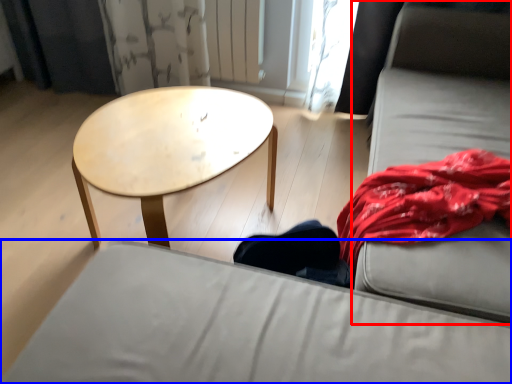
Question: Which of the following is the closest to the observer, couch (highlighted by a red box) or studio couch (highlighted by a blue box)?

Choices:
 (A) couch
 (B) studio couch

Answer: (B)